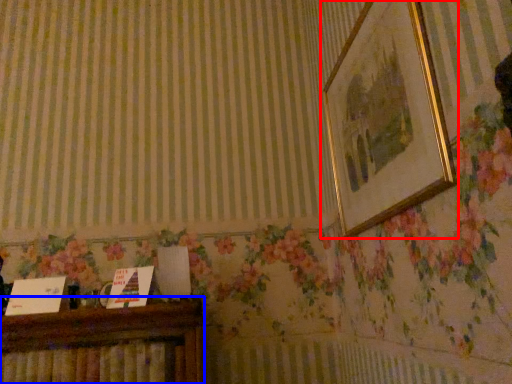
Question: Which of the following is the farthest to the observer, picture frame (highlighted by a red box) or furniture (highlighted by a blue box)?

Choices:
 (A) picture frame
 (B) furniture

Answer: (B)